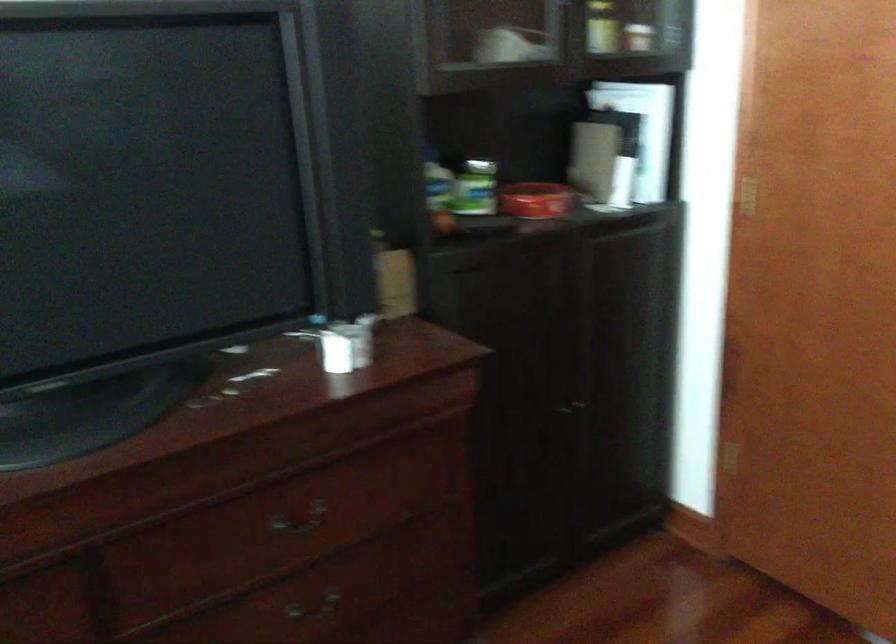
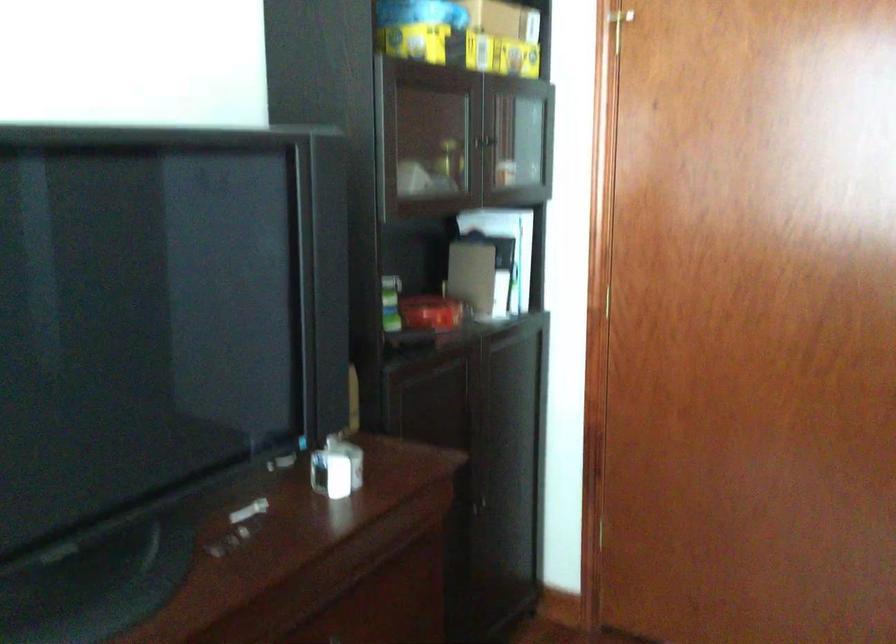
Question: What movement of the cameraman would produce the second image?

Choices:
 (A) Left
 (B) Right
 (C) Forward
 (D) Backward

Answer: (A)